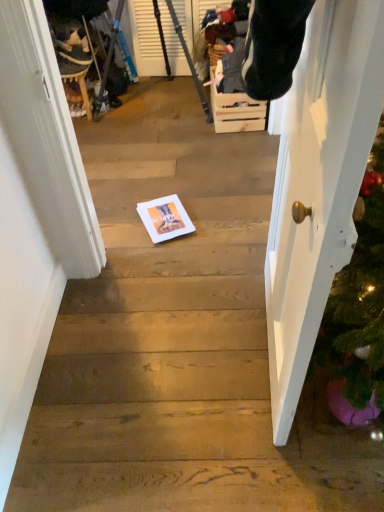
Locate an element on the screen. The width and height of the screenshot is (384, 512). free spot in front of wooden crate at center is located at coordinates (225, 143).